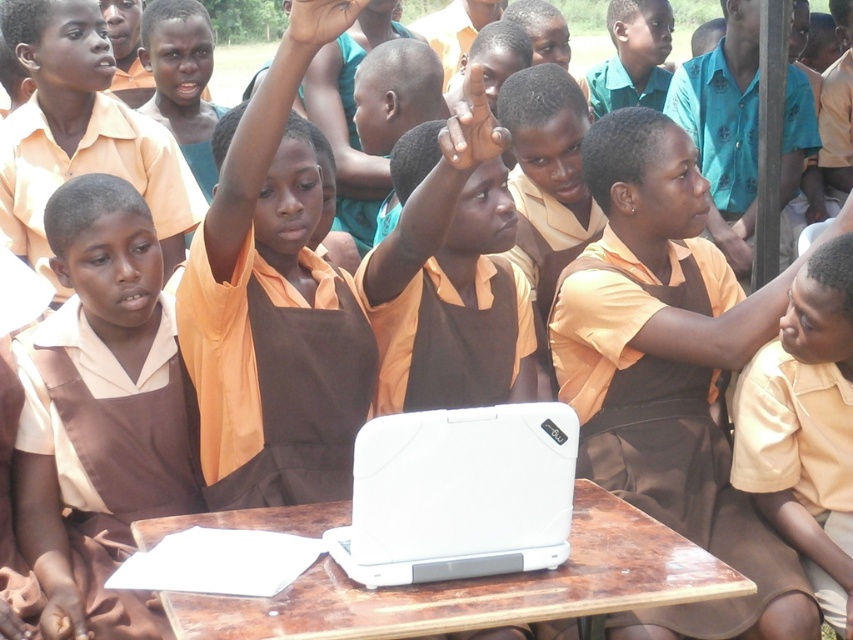
Locate an element on the screen. This screenshot has width=853, height=640. brown matte uniform at center is located at coordinates (102, 396).

Which of these two, brown matte uniform at center or white matte table at center, stands shorter?

white matte table at center is shorter.

Find the location of a particular element. Image resolution: width=853 pixels, height=640 pixels. brown matte uniform at center is located at coordinates (102, 396).

Does brown matte uniform at center have a greater height compared to orange matte shirt at upper center?

Yes, brown matte uniform at center is taller than orange matte shirt at upper center.

Can you confirm if brown matte uniform at center is positioned to the right of orange matte shirt at upper center?

Incorrect, brown matte uniform at center is not on the right side of orange matte shirt at upper center.

Identify the location of brown matte uniform at center. (102, 396).

Is white matte table at center below orange matte shirt at upper center?

Yes.

Is white matte table at center above orange matte shirt at upper center?

Incorrect, white matte table at center is not positioned above orange matte shirt at upper center.

The width and height of the screenshot is (853, 640). In order to click on white matte table at center in this screenshot , I will do `click(479, 588)`.

In order to click on white matte table at center in this screenshot , I will do `click(479, 588)`.